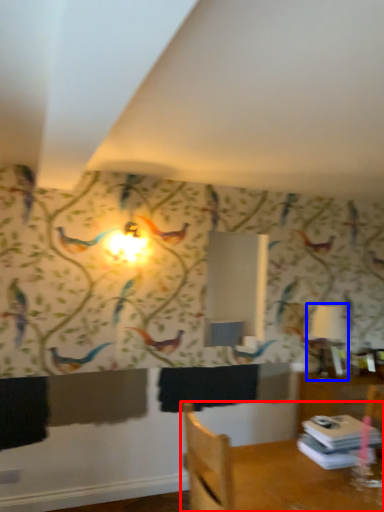
Question: Among these objects, which one is nearest to the camera, furniture (highlighted by a red box) or table lamp (highlighted by a blue box)?

Choices:
 (A) furniture
 (B) table lamp

Answer: (A)